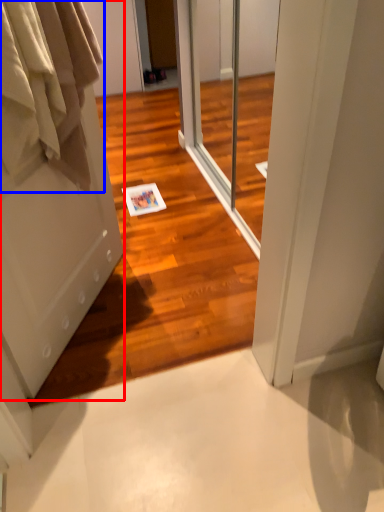
Question: Which object appears closest to the camera in this image, door (highlighted by a red box) or clothing (highlighted by a blue box)?

Choices:
 (A) door
 (B) clothing

Answer: (A)